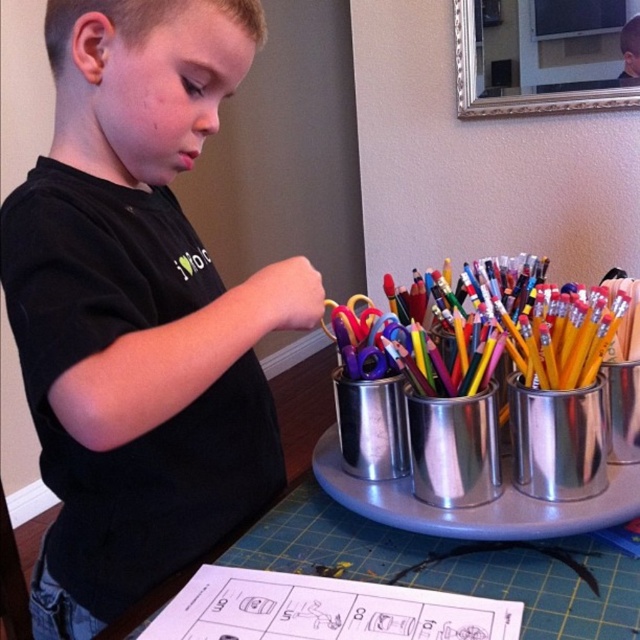
Find the location of a particular element. black matte shirt at center is located at coordinates 138,308.

Is point (96, 449) positioned after point (588, 326)?

No.

Which is behind, point (113, 369) or point (472, 385)?

Point (472, 385)

Find the location of a particular element. black matte shirt at center is located at coordinates (138, 308).